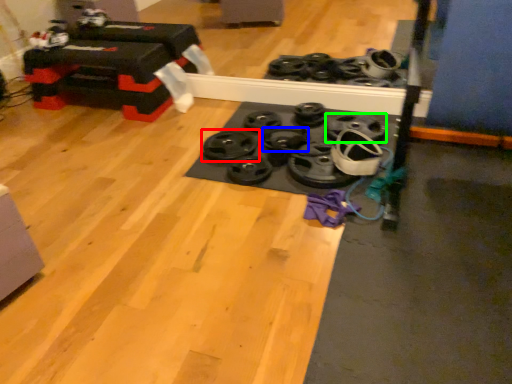
Question: Based on their relative distances, which object is nearer to wheel (highlighted by a red box)? Choose from wheel (highlighted by a blue box) and wheel (highlighted by a green box).

Choices:
 (A) wheel
 (B) wheel

Answer: (A)